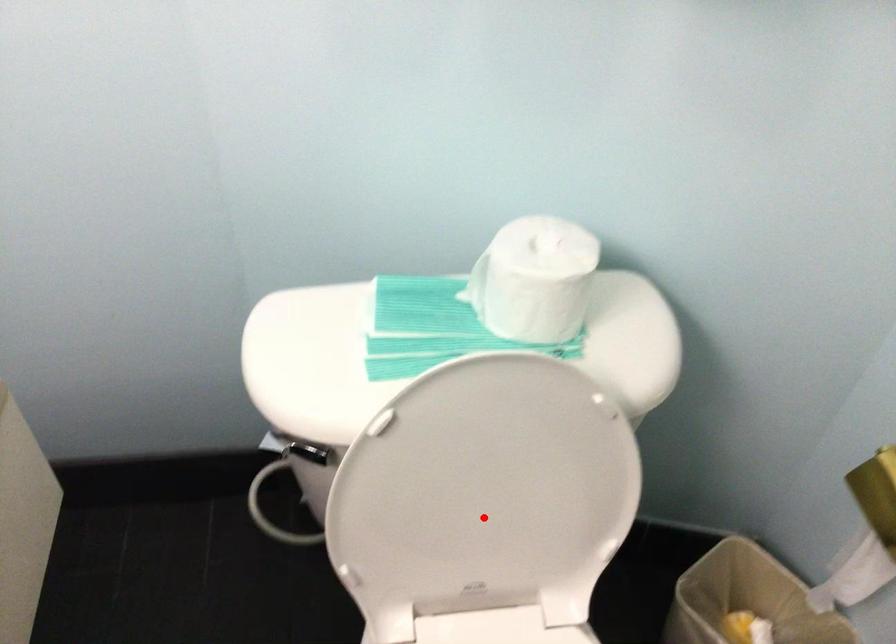
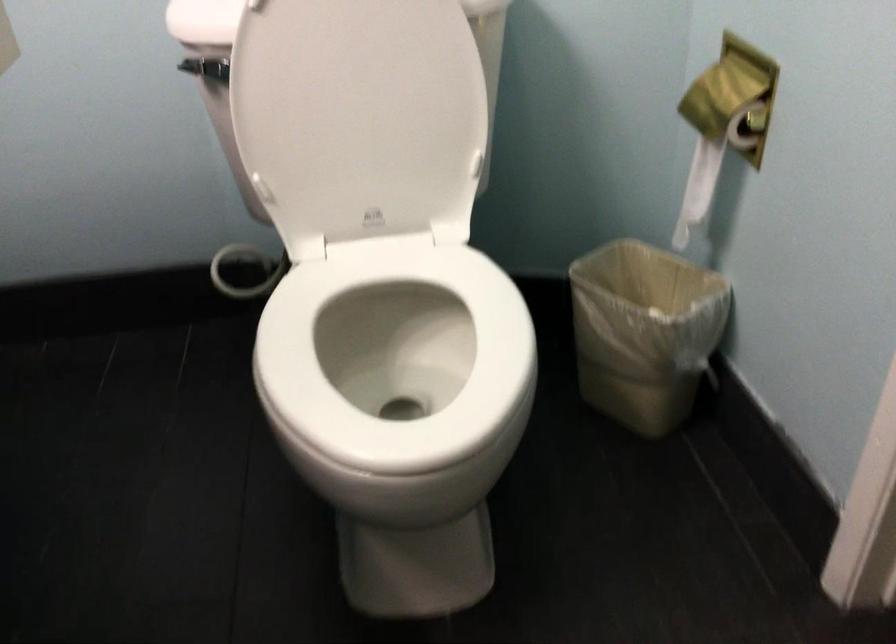
Question: A red point is marked in image1. In image2, is the corresponding 3D point closer to the camera or farther? Reply with the corresponding letter.

Choices:
 (A) The corresponding 3D point is closer.
 (B) The corresponding 3D point is farther.

Answer: (B)